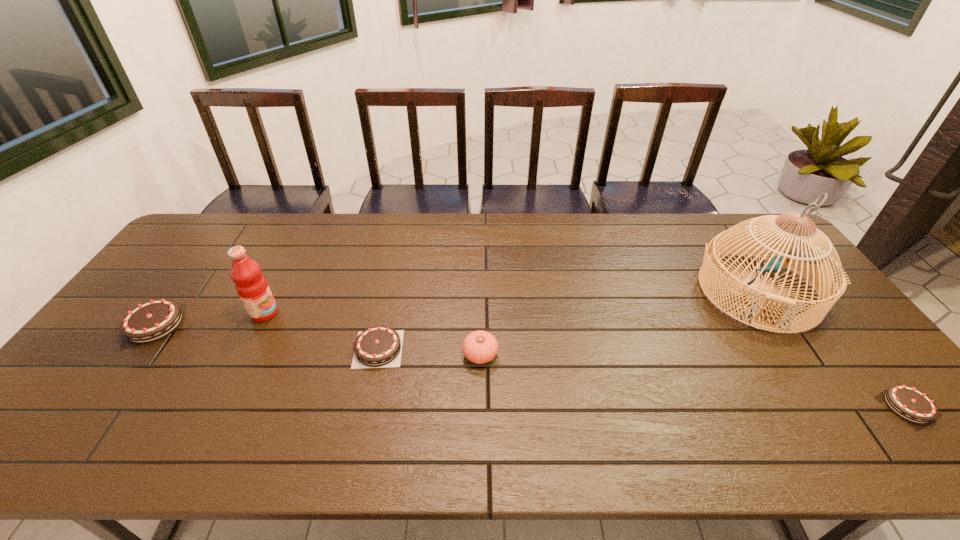
I want to click on birdcage located in the right edge section of the desktop, so click(x=803, y=250).

At what (x,y) coordinates should I click in order to perform the action: click on object at the near right corner. Please return your answer as a coordinate pair (x, y). Looking at the image, I should click on (909, 403).

At what (x,y) coordinates should I click in order to perform the action: click on free space at the far edge. Please return your answer as a coordinate pair (x, y). This screenshot has height=540, width=960. Looking at the image, I should click on (676, 241).

Identify the location of vacant space at the near edge of the desktop. The width and height of the screenshot is (960, 540). (794, 406).

Locate an element on the screen. Image resolution: width=960 pixels, height=540 pixels. vacant area at the left edge is located at coordinates (117, 329).

Where is `free region at the right edge of the desktop`? This screenshot has height=540, width=960. free region at the right edge of the desktop is located at coordinates (831, 377).

Image resolution: width=960 pixels, height=540 pixels. In the image, there is a desktop. In order to click on free space at the near right corner in this screenshot , I will do `click(864, 394)`.

This screenshot has width=960, height=540. I want to click on free space between the fourth object from right to left and the shortest object, so click(x=643, y=377).

Identify the location of free point between the nearest object and the fruit juice. (586, 360).

Where is `free space that is in between the birdcage and the leftmost object`? free space that is in between the birdcage and the leftmost object is located at coordinates (457, 308).